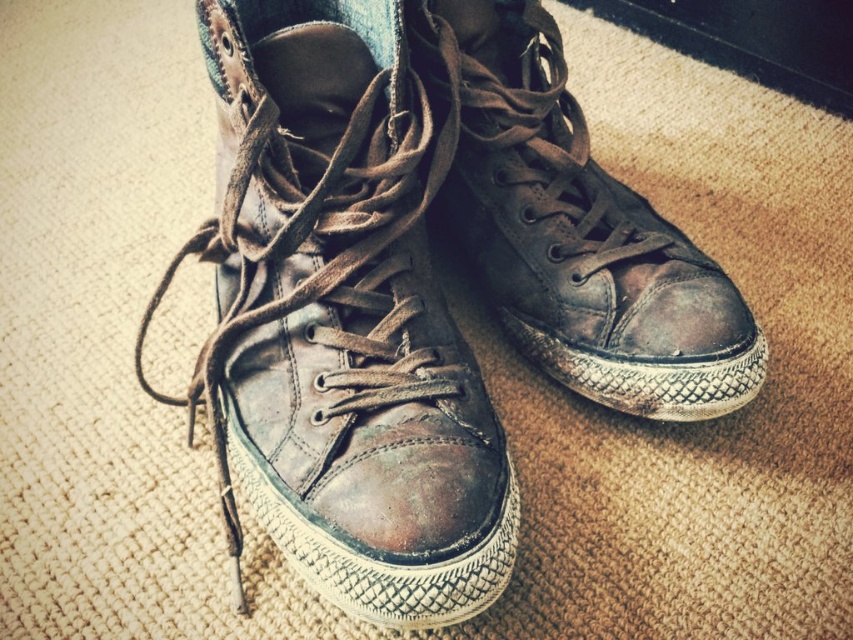
Question: Which point is closer to the camera taking this photo?

Choices:
 (A) (630, 330)
 (B) (334, 77)

Answer: (B)

Question: Which object is closer to the camera taking this photo?

Choices:
 (A) leather high-top sneaker at center
 (B) worn leather boot at center

Answer: (B)

Question: Which object is farther from the camera taking this photo?

Choices:
 (A) leather high-top sneaker at center
 (B) worn leather boot at center

Answer: (A)

Question: Does worn leather boot at center have a greater width compared to leather high-top sneaker at center?

Choices:
 (A) no
 (B) yes

Answer: (B)

Question: Is worn leather boot at center below leather high-top sneaker at center?

Choices:
 (A) yes
 (B) no

Answer: (A)

Question: From the image, what is the correct spatial relationship of worn leather boot at center in relation to leather high-top sneaker at center?

Choices:
 (A) right
 (B) left

Answer: (B)